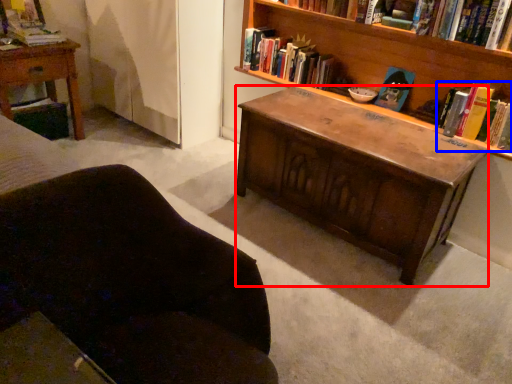
Question: Which object appears closest to the camera in this image, desk (highlighted by a red box) or book (highlighted by a blue box)?

Choices:
 (A) desk
 (B) book

Answer: (A)